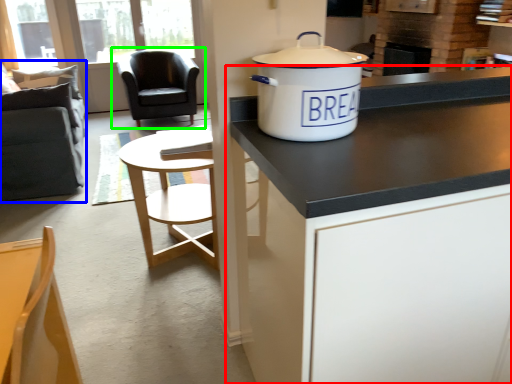
Question: Which object is the farthest from cabinetry (highlighted by a red box)? Choose among these: swivel chair (highlighted by a blue box) or chair (highlighted by a green box).

Choices:
 (A) swivel chair
 (B) chair

Answer: (B)